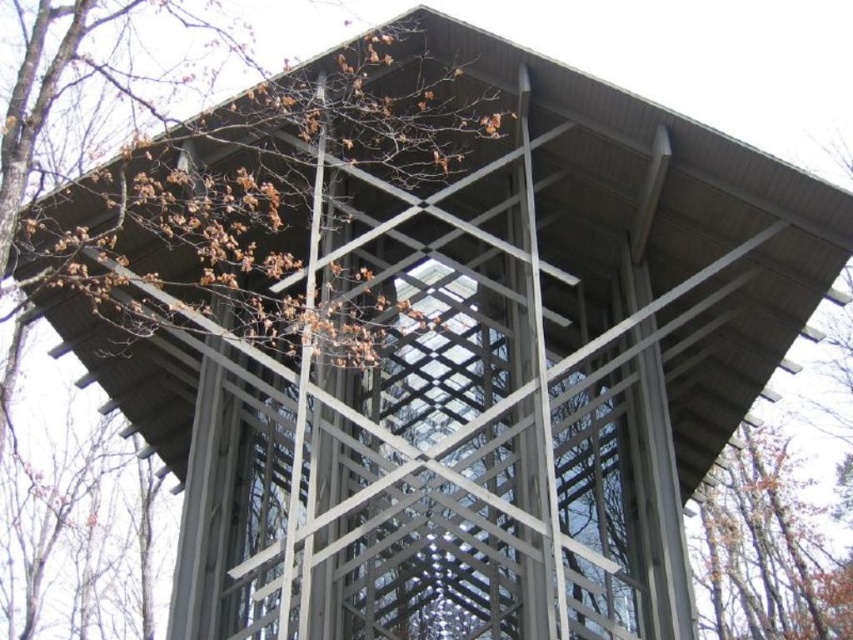
Who is higher up, brown wood tree at center or brown wood tree at upper right?

brown wood tree at center is above.

Which is behind, point (372, 310) or point (762, 550)?

Positioned behind is point (762, 550).

Locate an element on the screen. This screenshot has height=640, width=853. brown wood tree at center is located at coordinates (264, 198).